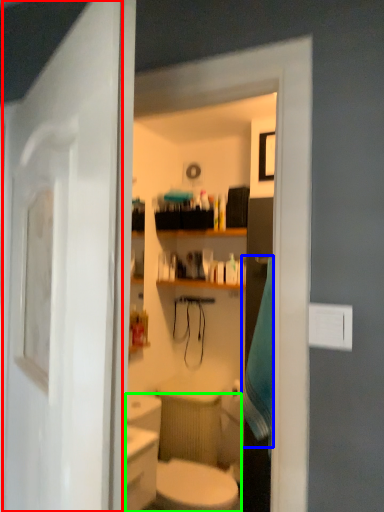
Question: Which is farther away from door (highlighted by a red box)? bath towel (highlighted by a blue box) or sink (highlighted by a green box)?

Choices:
 (A) bath towel
 (B) sink

Answer: (A)